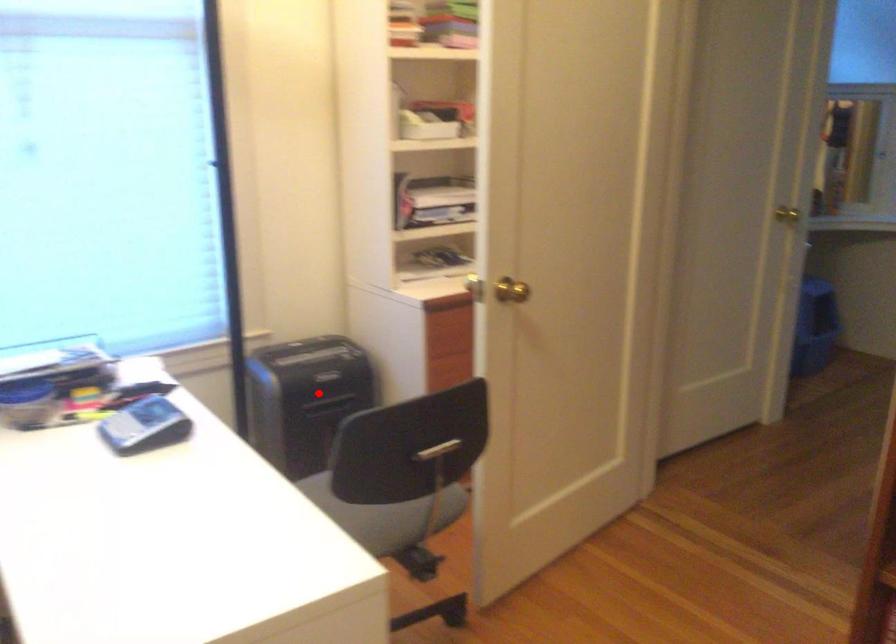
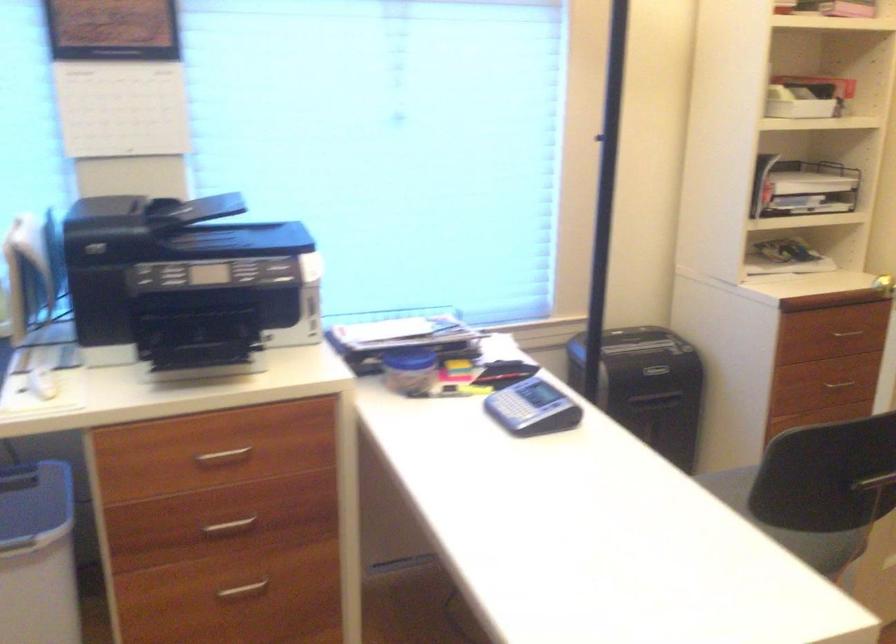
Find the pixel in the second image that matches the highlighted location in the first image.

(647, 386)